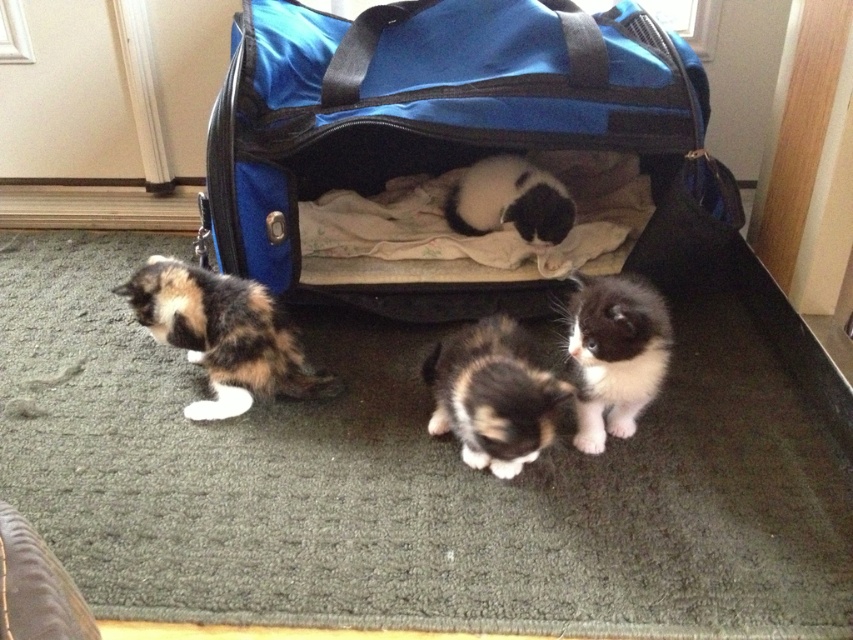
Question: Among these points, which one is nearest to the camera?

Choices:
 (A) (590, 227)
 (B) (485, 228)
 (C) (492, 460)
 (D) (662, 324)

Answer: (D)

Question: Among these points, which one is farthest from the camera?

Choices:
 (A) (395, 28)
 (B) (599, 358)
 (C) (463, 224)
 (D) (198, 412)

Answer: (C)

Question: Which point is closer to the camera taking this photo?

Choices:
 (A) (659, 108)
 (B) (569, 221)
 (C) (450, 426)

Answer: (C)

Question: Where is calico fur cat at left located in relation to calico fur kitten at center in the image?

Choices:
 (A) above
 (B) below

Answer: (A)

Question: Can you confirm if blue fabric bag at center is smaller than black fluffy cat at center?

Choices:
 (A) no
 (B) yes

Answer: (A)

Question: From the image, what is the correct spatial relationship of calico fur cat at left in relation to black fluffy cat at center?

Choices:
 (A) left
 (B) right

Answer: (A)